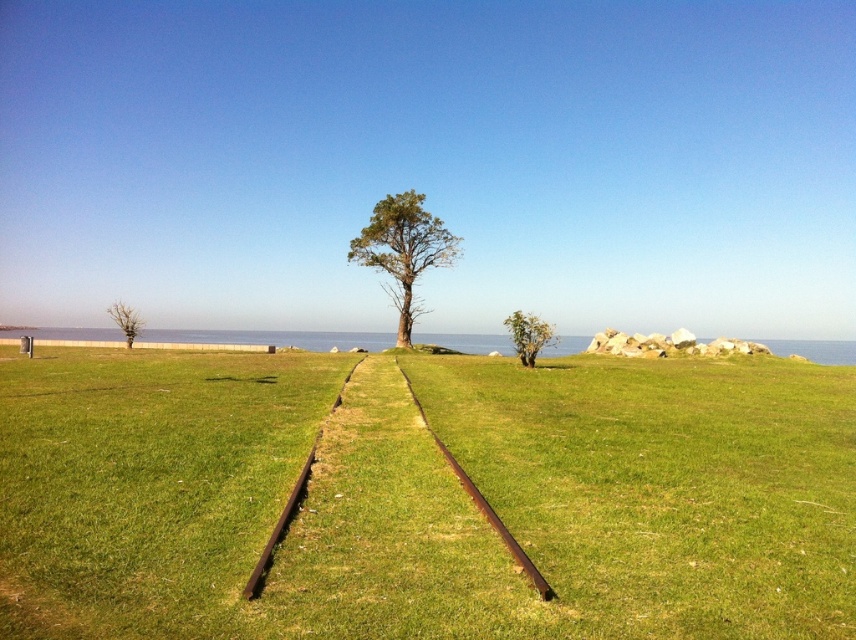
Question: Which object is the closest to the rusty metal train track at center?

Choices:
 (A) green leafy tree at lower left
 (B) green leafy tree at right

Answer: (B)

Question: In this image, where is rusty metal train track at center located relative to green leafy tree at lower left?

Choices:
 (A) left
 (B) right

Answer: (B)

Question: Is green leafy tree at center to the left of rusty metal train track at center from the viewer's perspective?

Choices:
 (A) yes
 (B) no

Answer: (A)

Question: Among these objects, which one is nearest to the camera?

Choices:
 (A) rusty metal train track at center
 (B) green leafy tree at lower left

Answer: (A)

Question: Is green leafy tree at right wider than green leafy tree at lower left?

Choices:
 (A) no
 (B) yes

Answer: (A)

Question: Which object appears farthest from the camera in this image?

Choices:
 (A) green leafy tree at center
 (B) green leafy tree at lower left
 (C) green grassy at center
 (D) rusty metal train track at center

Answer: (A)